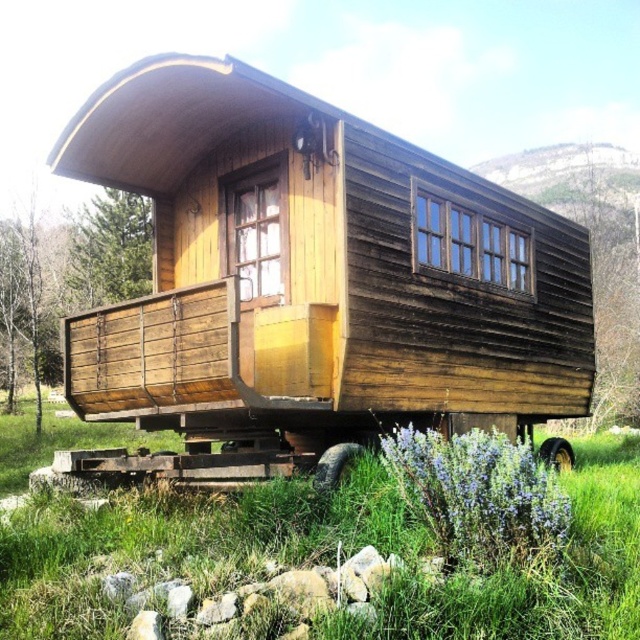
Question: Among these objects, which one is nearest to the camera?

Choices:
 (A) brown rubber wheel at lower right
 (B) dark brown rubber wheel at lower right

Answer: (B)

Question: Is weathered wood hut at center to the right of green grass at center from the viewer's perspective?

Choices:
 (A) no
 (B) yes

Answer: (A)

Question: Does weathered wood hut at center have a lesser width compared to dark brown rubber wheel at lower right?

Choices:
 (A) no
 (B) yes

Answer: (B)

Question: Which of the following is the farthest from the observer?

Choices:
 (A) (296, 536)
 (B) (556, 444)

Answer: (B)

Question: Among these points, which one is farthest from the camera?

Choices:
 (A) (216, 64)
 (B) (13, 534)
 (C) (337, 476)
 (D) (541, 452)

Answer: (D)

Question: Can you confirm if green grass at center is positioned below dark brown rubber wheel at lower right?

Choices:
 (A) no
 (B) yes

Answer: (B)